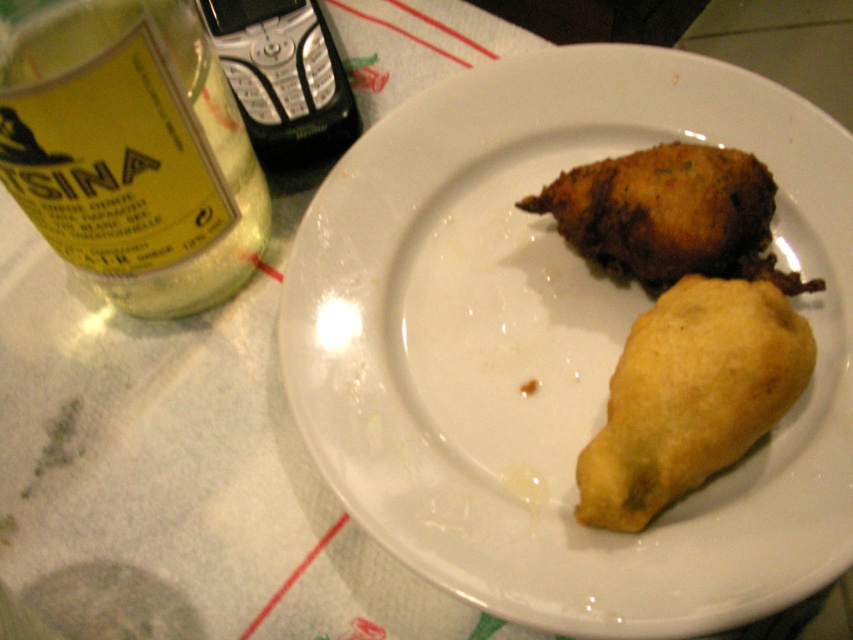
Question: Which of these objects is positioned farthest from the golden-brown fried food at center?

Choices:
 (A) golden crispy croquette at center
 (B) golden crispy pastry at center
 (C) translucent glass bottle at upper left

Answer: (C)

Question: Can you confirm if golden-brown fried food at center is positioned to the left of golden crispy pastry at center?

Choices:
 (A) no
 (B) yes

Answer: (B)

Question: Can you confirm if golden-brown fried food at center is positioned to the right of translucent glass bottle at upper left?

Choices:
 (A) yes
 (B) no

Answer: (A)

Question: Estimate the real-world distances between objects in this image. Which object is farther from the golden crispy croquette at center?

Choices:
 (A) golden-brown fried food at center
 (B) translucent glass bottle at upper left
 (C) golden crispy pastry at center

Answer: (B)

Question: Does golden crispy pastry at center appear over golden crispy croquette at center?

Choices:
 (A) no
 (B) yes

Answer: (A)

Question: Which point is farther to the camera?

Choices:
 (A) (96, 100)
 (B) (416, 173)
 (C) (704, 266)
 (D) (764, 396)

Answer: (B)